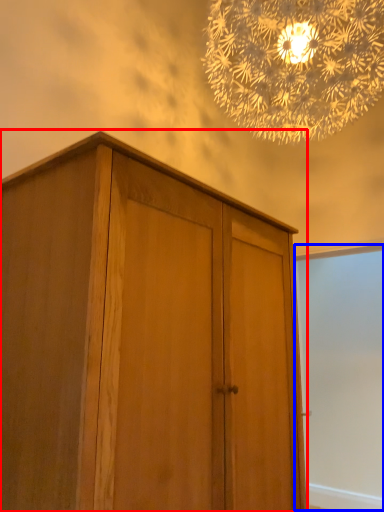
Question: Which point is further to the camera, cupboard (highlighted by a red box) or screen door (highlighted by a blue box)?

Choices:
 (A) cupboard
 (B) screen door

Answer: (B)